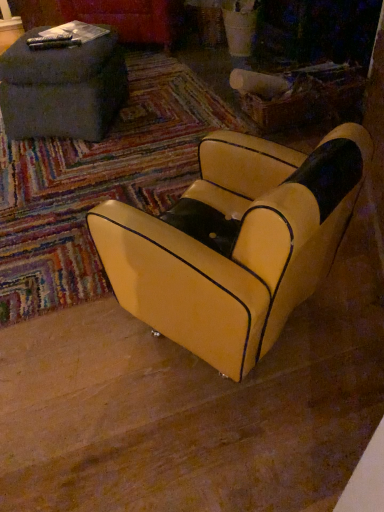
Question: Should I look upward or downward to see yellow leather chair at center?

Choices:
 (A) up
 (B) down

Answer: (A)

Question: Is dark gray fabric ottoman at upper left smaller than yellow leather chair at center?

Choices:
 (A) no
 (B) yes

Answer: (B)

Question: Is dark gray fabric ottoman at upper left not within yellow leather chair at center?

Choices:
 (A) no
 (B) yes

Answer: (B)

Question: Does dark gray fabric ottoman at upper left come behind yellow leather chair at center?

Choices:
 (A) yes
 (B) no

Answer: (A)

Question: Considering the relative positions of dark gray fabric ottoman at upper left and yellow leather chair at center in the image provided, is dark gray fabric ottoman at upper left to the left of yellow leather chair at center from the viewer's perspective?

Choices:
 (A) yes
 (B) no

Answer: (A)

Question: From the image's perspective, is dark gray fabric ottoman at upper left over yellow leather chair at center?

Choices:
 (A) no
 (B) yes

Answer: (B)

Question: From a real-world perspective, is dark gray fabric ottoman at upper left positioned over yellow leather chair at center based on gravity?

Choices:
 (A) no
 (B) yes

Answer: (A)

Question: From a real-world perspective, is yellow leather chair at center under dark gray fabric ottoman at upper left?

Choices:
 (A) no
 (B) yes

Answer: (A)

Question: Is yellow leather chair at center positioned far away from dark gray fabric ottoman at upper left?

Choices:
 (A) no
 (B) yes

Answer: (B)

Question: Would you say yellow leather chair at center contains dark gray fabric ottoman at upper left?

Choices:
 (A) yes
 (B) no

Answer: (B)

Question: Considering the relative sizes of yellow leather chair at center and dark gray fabric ottoman at upper left in the image provided, is yellow leather chair at center wider than dark gray fabric ottoman at upper left?

Choices:
 (A) no
 (B) yes

Answer: (A)

Question: Does yellow leather chair at center have a lesser width compared to dark gray fabric ottoman at upper left?

Choices:
 (A) no
 (B) yes

Answer: (B)

Question: Is yellow leather chair at center facing away from dark gray fabric ottoman at upper left?

Choices:
 (A) no
 (B) yes

Answer: (A)

Question: Relative to dark gray fabric ottoman at upper left, is yellow leather chair at center in front or behind?

Choices:
 (A) behind
 (B) front

Answer: (B)